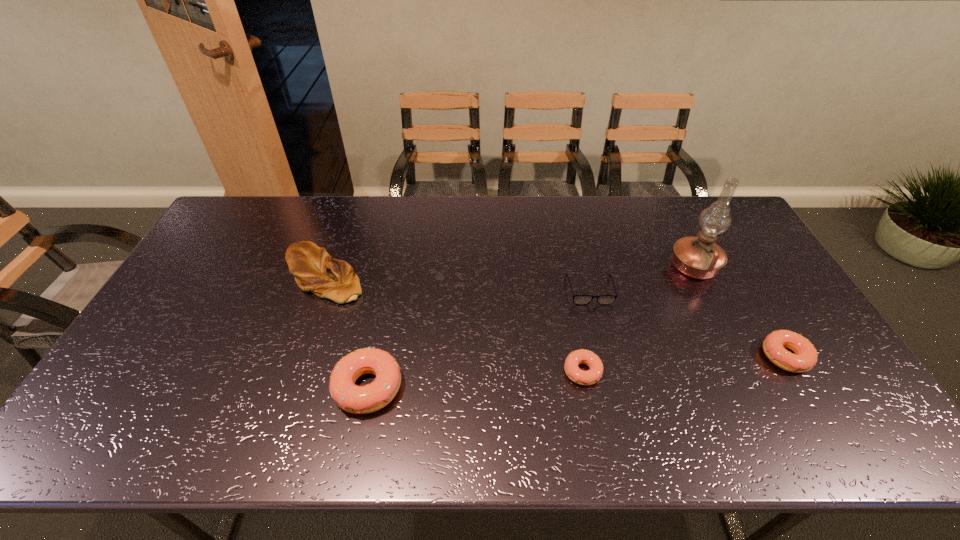
Image resolution: width=960 pixels, height=540 pixels. What are the coordinates of `unoccupied area between the oil lamp and the spectacles` in the screenshot? It's located at [x=642, y=279].

The width and height of the screenshot is (960, 540). I want to click on free space between the second doughnut from left to right and the tallest doughnut, so click(x=475, y=380).

This screenshot has height=540, width=960. Identify the location of empty space that is in between the spectacles and the tallest doughnut. (479, 339).

Locate an element on the screen. vacant space in between the bread and the spectacles is located at coordinates (457, 283).

Find the location of a particular element. vacant area that lies between the bread and the shortest doughnut is located at coordinates (453, 323).

In order to click on free space between the spectacles and the bread in this screenshot , I will do `click(457, 283)`.

I want to click on free area in between the spectacles and the bread, so click(457, 283).

Locate an element on the screen. This screenshot has width=960, height=540. vacant point located between the spectacles and the tallest doughnut is located at coordinates (479, 339).

Choose which object is the fourth nearest neighbor to the tallest object. Please provide its 2D coordinates. Your answer should be formatted as a tuple, i.e. [(x, y)], where the tuple contains the x and y coordinates of a point satisfying the conditions above.

[(352, 398)]

At what (x,y) coordinates should I click in order to perform the action: click on the fifth closest object to the leftmost doughnut. Please return your answer as a coordinate pair (x, y). This screenshot has width=960, height=540. Looking at the image, I should click on (805, 357).